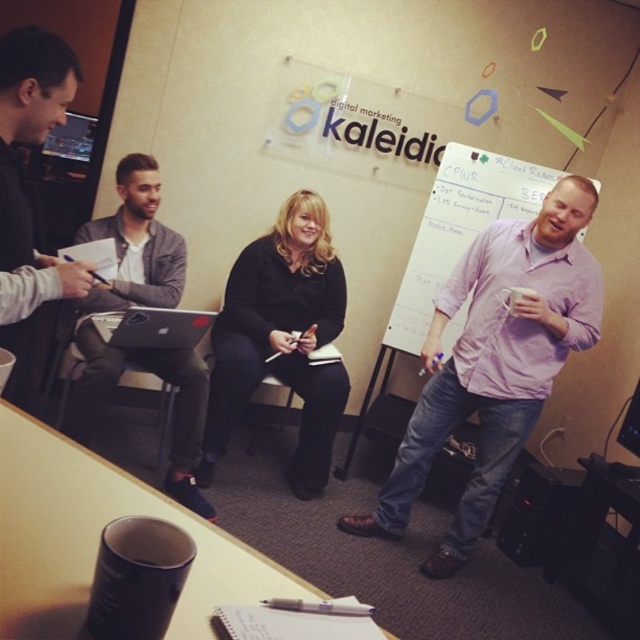
Question: Among these points, which one is nearest to the camera?

Choices:
 (A) tap(20, 124)
 (B) tap(157, 221)

Answer: (A)

Question: Which point is closer to the camera?

Choices:
 (A) (180, 408)
 (B) (20, 392)

Answer: (B)

Question: Is black matte jacket at center wider than matte black laptop at left?

Choices:
 (A) no
 (B) yes

Answer: (B)

Question: Where is purple cotton shirt at right located in relation to satin black laptop at center in the image?

Choices:
 (A) left
 (B) right

Answer: (B)

Question: Is whiteboard at center thinner than matte black laptop at left?

Choices:
 (A) yes
 (B) no

Answer: (B)

Question: Considering the real-world distances, which object is closest to the black matte cup at lower center?

Choices:
 (A) whiteboard at center
 (B) brushed metal laptop at left
 (C) satin black laptop at center
 (D) matte black laptop at left

Answer: (D)